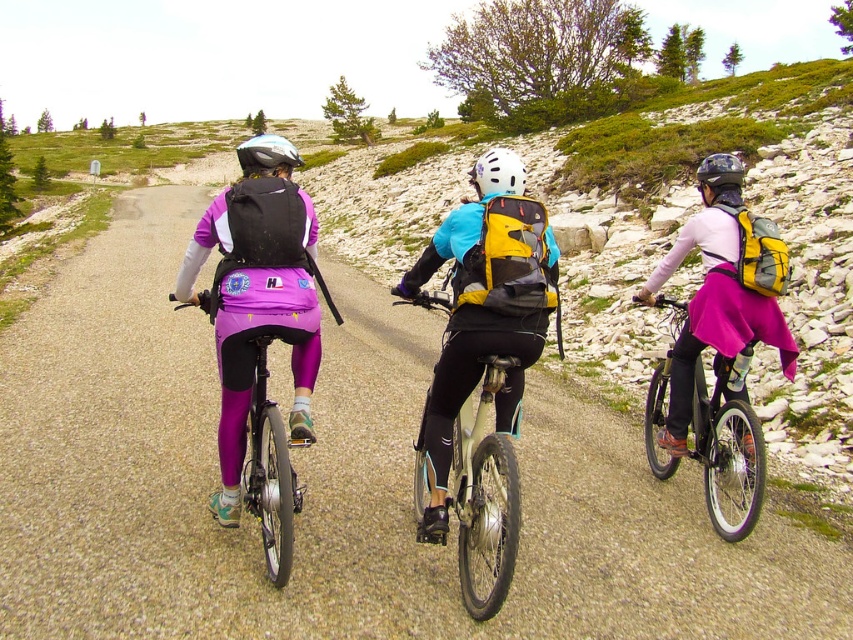
Question: Which object appears closest to the camera in this image?

Choices:
 (A) pink fabric skirt at center
 (B) metallic silver bicycle at right

Answer: (B)

Question: Is metallic silver bicycle at right below matte black helmet at center?

Choices:
 (A) no
 (B) yes

Answer: (B)

Question: Can you confirm if pink fabric skirt at center is wider than metallic silver bicycle at right?

Choices:
 (A) no
 (B) yes

Answer: (B)

Question: Is pink fabric skirt at center positioned in front of white matte helmet at center?

Choices:
 (A) yes
 (B) no

Answer: (B)

Question: Which point is closer to the camera?

Choices:
 (A) (184, 332)
 (B) (497, 161)
 (C) (486, 460)

Answer: (C)

Question: Which is farther from the metallic silver bicycle at center?

Choices:
 (A) metallic silver bicycle at right
 (B) matte black helmet at center
 (C) white matte helmet at center

Answer: (B)